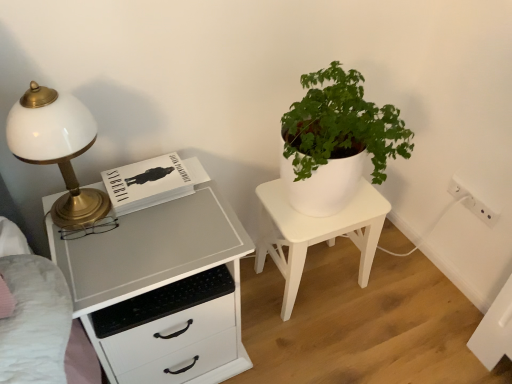
Image resolution: width=512 pixels, height=384 pixels. In order to click on vacant area to the right of white glossy lamp at left in this screenshot , I will do `click(152, 230)`.